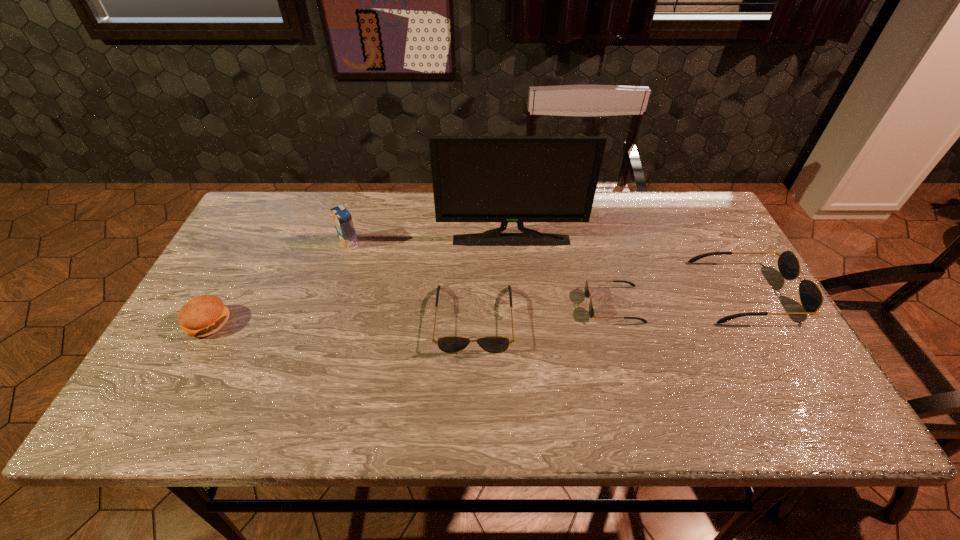
The height and width of the screenshot is (540, 960). Identify the location of vacant space at the right edge of the desktop. (684, 246).

In the image, there is a desktop. In order to click on vacant space at the far left corner in this screenshot , I will do `click(269, 213)`.

Locate an element on the screen. free space at the near left corner of the desktop is located at coordinates (180, 385).

Locate an element on the screen. The height and width of the screenshot is (540, 960). vacant area at the far right corner of the desktop is located at coordinates (689, 221).

At what (x,y) coordinates should I click in order to perform the action: click on empty space that is in between the leftmost object and the second object from left to right. Please return your answer as a coordinate pair (x, y). Image resolution: width=960 pixels, height=540 pixels. Looking at the image, I should click on (278, 283).

You are a GUI agent. You are given a task and a screenshot of the screen. Output one action in this format:
    pyautogui.click(x=<x>, y=<y>)
    Task: Click on the vacant space in between the tallest object and the shortest object
    Image resolution: width=960 pixels, height=540 pixels.
    Given the screenshot: What is the action you would take?
    pyautogui.click(x=563, y=272)

The height and width of the screenshot is (540, 960). What are the coordinates of `empty space that is in between the monitor and the rightmost sunglasses` in the screenshot? It's located at (629, 266).

This screenshot has width=960, height=540. What are the coordinates of `free space between the rightmost sunglasses and the tallest object` in the screenshot? It's located at (629, 266).

Where is `free spot between the orange_juice and the rightmost object`? The height and width of the screenshot is (540, 960). free spot between the orange_juice and the rightmost object is located at coordinates (548, 267).

You are a GUI agent. You are given a task and a screenshot of the screen. Output one action in this format:
    pyautogui.click(x=<x>, y=<y>)
    Task: Click on the free area in between the leftmost sunglasses and the rightmost object
    
    Given the screenshot: What is the action you would take?
    pyautogui.click(x=611, y=305)